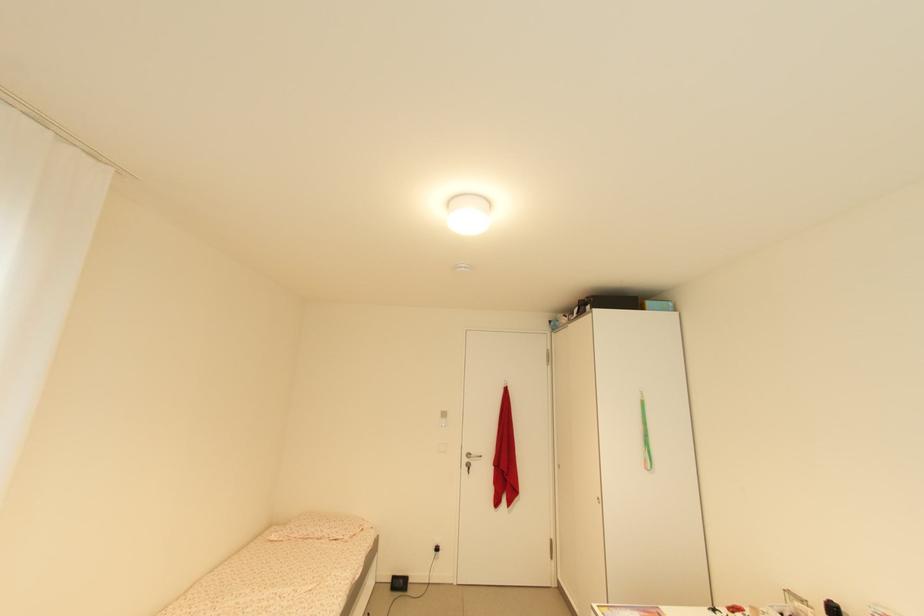
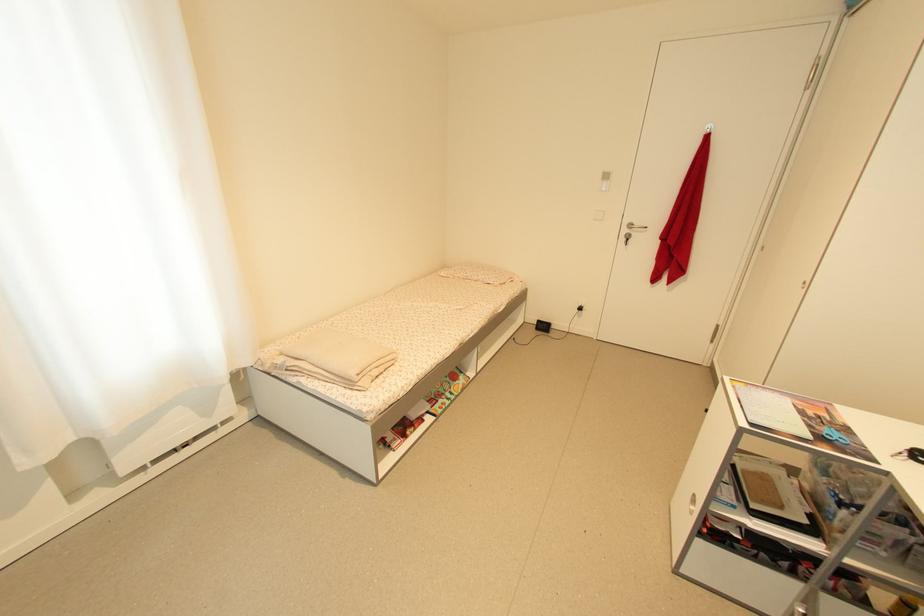
Where in the second image is the point corresponding to [332,538] from the first image?

(485, 282)